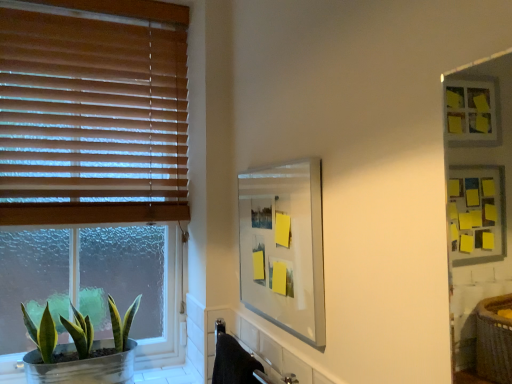
Question: From a real-world perspective, is wooden blinds at left physically located above or below clear glass mirror at center?

Choices:
 (A) above
 (B) below

Answer: (A)

Question: Is wooden blinds at left wider or thinner than clear glass mirror at center?

Choices:
 (A) thin
 (B) wide

Answer: (B)

Question: Which object is the closest to the clear glass mirror at center?

Choices:
 (A) green matte plant at lower left
 (B) wooden blinds at left

Answer: (B)

Question: Based on their relative distances, which object is nearer to the wooden blinds at left?

Choices:
 (A) clear glass mirror at center
 (B) green matte plant at lower left

Answer: (B)